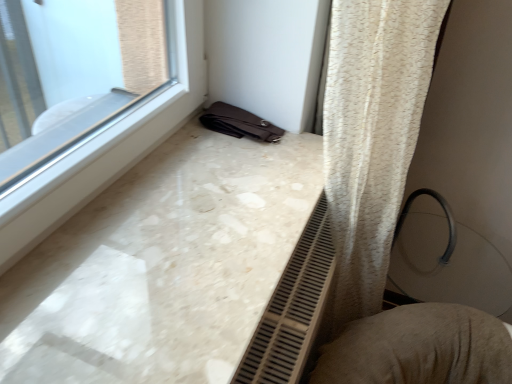
The width and height of the screenshot is (512, 384). What do you see at coordinates (418, 348) in the screenshot?
I see `textured beige cushion at lower right` at bounding box center [418, 348].

This screenshot has width=512, height=384. In order to click on textured beige cushion at lower right in this screenshot , I will do `click(418, 348)`.

You are a GUI agent. You are given a task and a screenshot of the screen. Output one action in this format:
    pyautogui.click(x=<x>, y=<y>)
    Task: Click on the white marble counter top at lower left
    
    Given the screenshot: What is the action you would take?
    pyautogui.click(x=162, y=266)

Measure the distance between white marble counter top at lower left and camera.

white marble counter top at lower left and camera are 21.26 inches apart.

The height and width of the screenshot is (384, 512). What do you see at coordinates (162, 266) in the screenshot?
I see `white marble counter top at lower left` at bounding box center [162, 266].

I want to click on textured beige cushion at lower right, so click(x=418, y=348).

Which is more to the left, white marble counter top at lower left or textured beige cushion at lower right?

white marble counter top at lower left.

Which object is further away from the camera taking this photo, white marble counter top at lower left or textured beige cushion at lower right?

textured beige cushion at lower right.

Does point (67, 354) appear closer or farther from the camera than point (394, 356)?

Point (67, 354) is closer to the camera than point (394, 356).

From the image's perspective, which one is positioned higher, white marble counter top at lower left or textured beige cushion at lower right?

white marble counter top at lower left is shown above in the image.

From a real-world perspective, which object stands above the other?

From a 3D spatial view, white marble counter top at lower left is above.

Does white marble counter top at lower left have a greater width compared to textured beige cushion at lower right?

Yes, white marble counter top at lower left is wider than textured beige cushion at lower right.

Does white marble counter top at lower left have a greater height compared to textured beige cushion at lower right?

No, white marble counter top at lower left is not taller than textured beige cushion at lower right.

Considering the relative sizes of white marble counter top at lower left and textured beige cushion at lower right in the image provided, is white marble counter top at lower left smaller than textured beige cushion at lower right?

Yes.

Would you say white marble counter top at lower left is outside textured beige cushion at lower right?

Yes.

Is white marble counter top at lower left touching textured beige cushion at lower right?

white marble counter top at lower left and textured beige cushion at lower right are not in contact.

Is white marble counter top at lower left facing away from textured beige cushion at lower right?

No.

Measure the distance from white marble counter top at lower left to textured beige cushion at lower right.

white marble counter top at lower left and textured beige cushion at lower right are 16.21 inches apart.

Identify the location of swivel chair located underneath the white marble counter top at lower left (from a real-world perspective). (418, 348).

Would you say textured beige cushion at lower right is to the left or to the right of white marble counter top at lower left in the picture?

textured beige cushion at lower right is positioned on white marble counter top at lower left's right side.

Which is in front, textured beige cushion at lower right or white marble counter top at lower left?

white marble counter top at lower left is closer to the camera.

Does point (441, 363) appear closer or farther from the camera than point (294, 181)?

Point (441, 363) is positioned farther from the camera compared to point (294, 181).

From the image's perspective, is textured beige cushion at lower right positioned above or below white marble counter top at lower left?

Clearly, from the image's perspective, textured beige cushion at lower right is below white marble counter top at lower left.

From a real-world perspective, is textured beige cushion at lower right on white marble counter top at lower left?

No, from a real-world perspective, textured beige cushion at lower right is not on top of white marble counter top at lower left.

Does textured beige cushion at lower right have a lesser width compared to white marble counter top at lower left?

Yes, textured beige cushion at lower right is thinner than white marble counter top at lower left.

Who is taller, textured beige cushion at lower right or white marble counter top at lower left?

Standing taller between the two is textured beige cushion at lower right.

Which of these two, textured beige cushion at lower right or white marble counter top at lower left, is bigger?

textured beige cushion at lower right is bigger.

Does textured beige cushion at lower right contain white marble counter top at lower left?

Definitely not — white marble counter top at lower left is not inside textured beige cushion at lower right.

Does textured beige cushion at lower right touch white marble counter top at lower left?

There is a gap between textured beige cushion at lower right and white marble counter top at lower left.

Is textured beige cushion at lower right facing towards white marble counter top at lower left?

No, textured beige cushion at lower right is not facing towards white marble counter top at lower left.

What's the angular difference between textured beige cushion at lower right and white marble counter top at lower left's facing directions?

The angular difference between textured beige cushion at lower right and white marble counter top at lower left is 27 degrees.

Image resolution: width=512 pixels, height=384 pixels. Identify the location of swivel chair below the white marble counter top at lower left (from the image's perspective). (418, 348).

In the image, there is a white marble counter top at lower left. Identify the location of swivel chair below it (from a real-world perspective). This screenshot has width=512, height=384. (418, 348).

Locate an element on the screen. The width and height of the screenshot is (512, 384). counter top to the left of textured beige cushion at lower right is located at coordinates (162, 266).